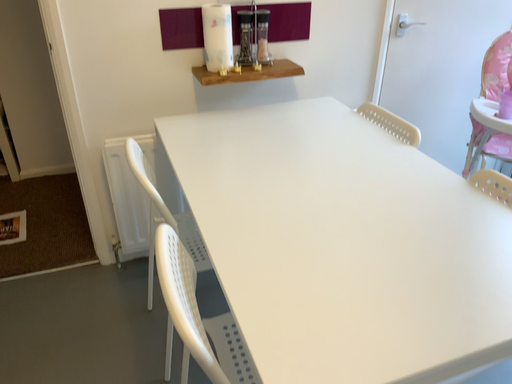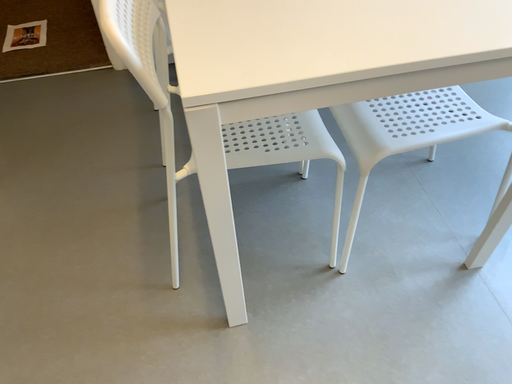
Question: Which way did the camera rotate in the video?

Choices:
 (A) rotated upward
 (B) rotated downward

Answer: (B)